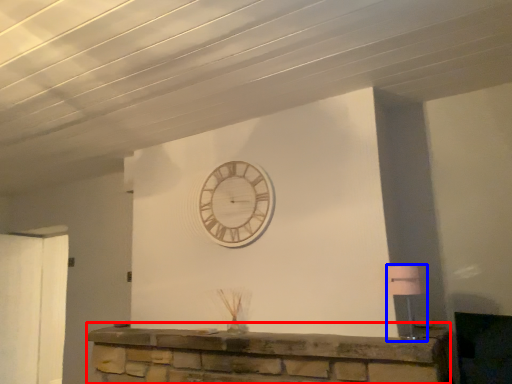
Question: Which point is closer to the camera, furniture (highlighted by a red box) or lamp (highlighted by a blue box)?

Choices:
 (A) furniture
 (B) lamp

Answer: (A)